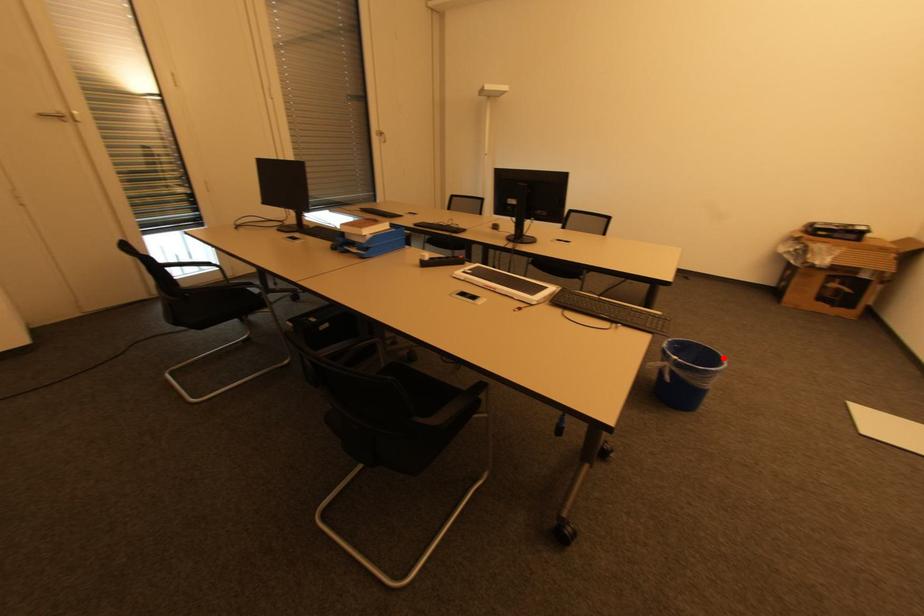
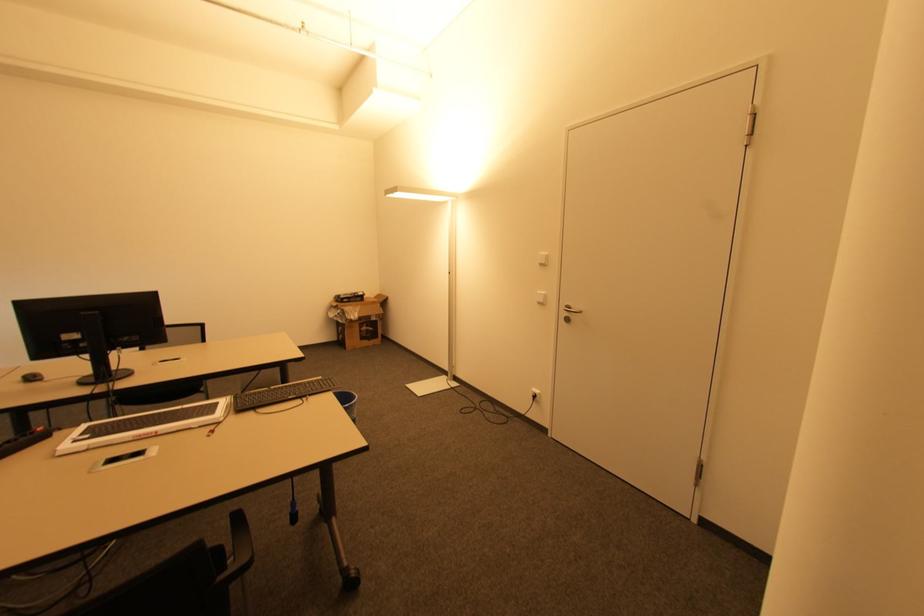
Question: I am providing you with two images of the same scene from different viewpoints. In image1, a red point is highlighted. Considering the same 3D point in image2, which of the following is correct?

Choices:
 (A) It is closer
 (B) It is farther

Answer: (B)